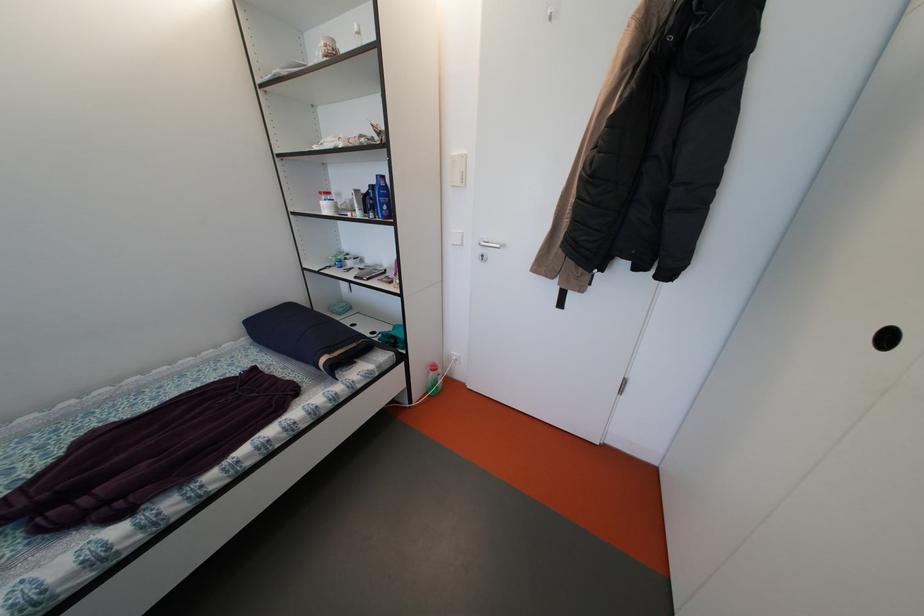
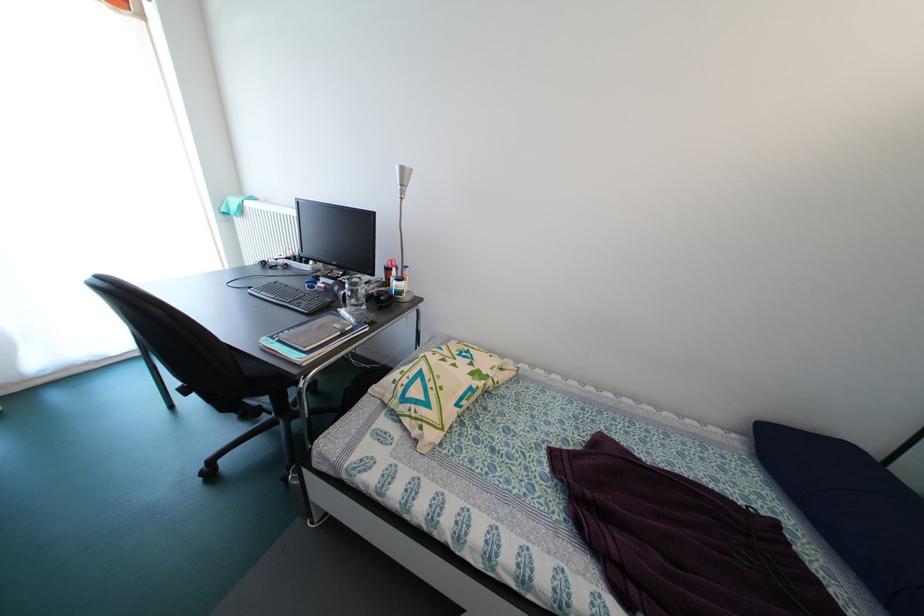
Based on the continuous images, in which direction is the camera rotating?

The rotation direction of the camera is left-down.